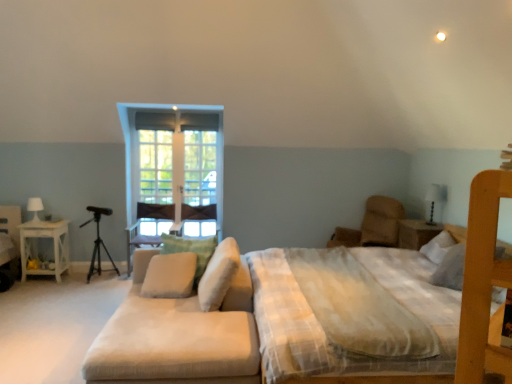
Question: Is white soft pillow at center, which appears as the 1th pillow when viewed from the right, to the right of white glossy table lamp at upper right, which appears as the second table lamp when viewed from the left, from the viewer's perspective?

Choices:
 (A) no
 (B) yes

Answer: (A)

Question: From the image's perspective, is white soft pillow at center, which appears as the 1th pillow when viewed from the right, located above white glossy table lamp at upper right, which appears as the first table lamp when viewed from the front?

Choices:
 (A) yes
 (B) no

Answer: (B)

Question: Is white soft pillow at center, acting as the third pillow starting from the left, to the left of white glossy table lamp at upper right, which appears as the first table lamp when viewed from the right, from the viewer's perspective?

Choices:
 (A) yes
 (B) no

Answer: (A)

Question: Are white soft pillow at center, acting as the third pillow starting from the left, and white glossy table lamp at upper right, which appears as the first table lamp when viewed from the front, far apart?

Choices:
 (A) yes
 (B) no

Answer: (A)

Question: Is white soft pillow at center, which appears as the 1th pillow when viewed from the right, shorter than white glossy table lamp at upper right, which appears as the 2th table lamp when viewed from the back?

Choices:
 (A) no
 (B) yes

Answer: (B)

Question: In terms of height, does white soft pillow at center, which appears as the 1th pillow when viewed from the right, look taller or shorter compared to white wood nightstand at left, which is counted as the 2th nightstand, starting from the right?

Choices:
 (A) short
 (B) tall

Answer: (A)

Question: From a real-world perspective, is white soft pillow at center, which appears as the 1th pillow when viewed from the right, physically located above or below white wood nightstand at left, which is counted as the 2th nightstand, starting from the right?

Choices:
 (A) below
 (B) above

Answer: (B)

Question: From the image's perspective, is white soft pillow at center, acting as the third pillow starting from the left, positioned above or below white wood nightstand at left, which is counted as the 2th nightstand, starting from the right?

Choices:
 (A) above
 (B) below

Answer: (A)

Question: Is point coord(212,302) closer or farther from the camera than point coord(22,258)?

Choices:
 (A) farther
 (B) closer

Answer: (B)

Question: From their relative heights in the image, would you say clear glass screen door at center is taller or shorter than beige fabric couch at lower left?

Choices:
 (A) short
 (B) tall

Answer: (B)

Question: Considering the positions of clear glass screen door at center and beige fabric couch at lower left in the image, is clear glass screen door at center wider or thinner than beige fabric couch at lower left?

Choices:
 (A) thin
 (B) wide

Answer: (A)

Question: Considering the positions of clear glass screen door at center and beige fabric couch at lower left in the image, is clear glass screen door at center bigger or smaller than beige fabric couch at lower left?

Choices:
 (A) small
 (B) big

Answer: (A)

Question: In the image, is clear glass screen door at center positioned in front of or behind beige fabric couch at lower left?

Choices:
 (A) front
 (B) behind

Answer: (B)

Question: Would you say beige fabric armchair at center is to the left or to the right of beige fabric couch at lower left in the picture?

Choices:
 (A) right
 (B) left

Answer: (B)

Question: In the image, is beige fabric armchair at center positioned in front of or behind beige fabric couch at lower left?

Choices:
 (A) front
 (B) behind

Answer: (B)